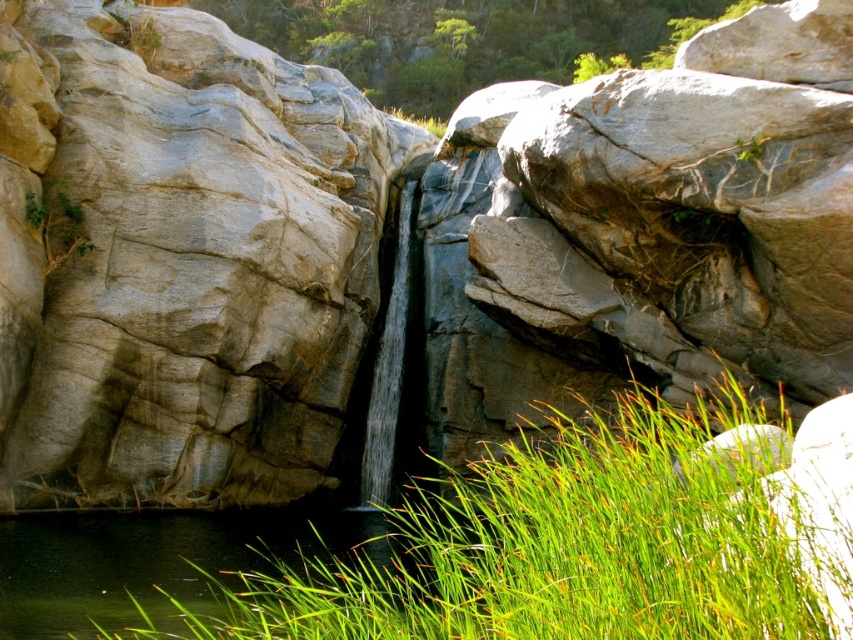
You are standing at the edge of the scene and want to cross to the other side. You notice the green grass at center and the clear water at center. Which path should you choose to ensure you can walk without getting your feet wet?

You should choose the green grass at center because its width is larger than the clear water at center, making it a safer and drier path to walk on.

You are standing at the edge of the waterfall and see the green grass at upper center and the clear water at center. Which object is higher in elevation?

The green grass at upper center is higher in elevation than the clear water at center because it is positioned above it.

You are a photographer planning to capture the waterfall scene. You want to ensure that the green grass at upper center and the clear water at center are both visible in your shot. Based on their sizes, which object should you focus on to frame the composition properly?

The green grass at upper center has a larger width than the clear water at center, so focusing on the green grass at upper center would help frame the composition properly due to its greater size.